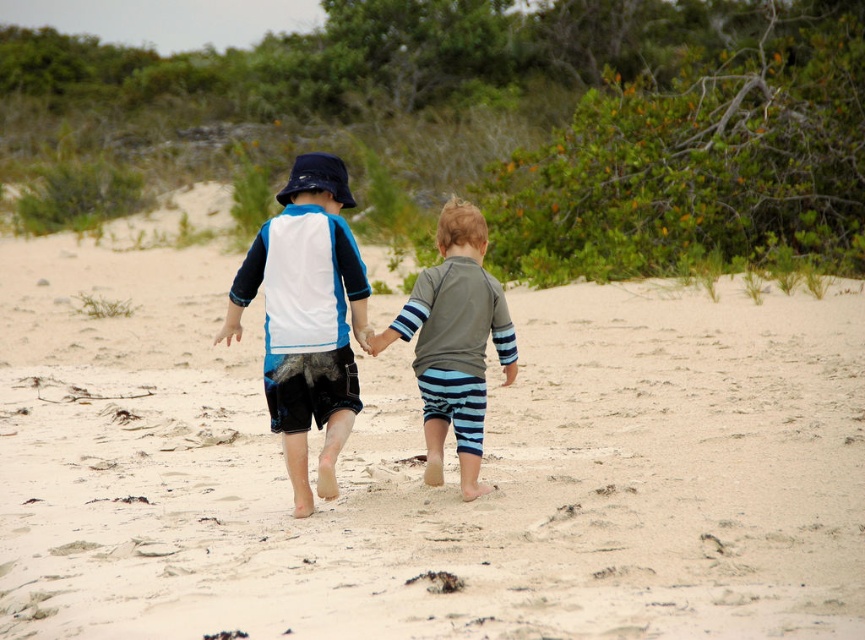
Looking at this image, between gray matte rash guard at center and blue striped shorts at center, which one appears on the left side from the viewer's perspective?

blue striped shorts at center is more to the left.

Consider the image. Can you confirm if gray matte rash guard at center is positioned to the left of blue striped shorts at center?

No, gray matte rash guard at center is not to the left of blue striped shorts at center.

Is point (468, 307) more distant than point (372, 337)?

No, (468, 307) is in front of (372, 337).

Identify the location of gray matte rash guard at center. (456, 340).

Does matte blue and white rash guard at center have a greater height compared to blue striped shorts at center?

Indeed, matte blue and white rash guard at center has a greater height compared to blue striped shorts at center.

You are a GUI agent. You are given a task and a screenshot of the screen. Output one action in this format:
    pyautogui.click(x=<x>, y=<y>)
    Task: Click on the matte blue and white rash guard at center
    
    Given the screenshot: What is the action you would take?
    pyautogui.click(x=306, y=317)

Who is more distant from viewer, (316,250) or (408,300)?

The point (408,300) is behind.

Who is higher up, matte blue and white rash guard at center or gray matte rash guard at center?

matte blue and white rash guard at center is higher up.

Is point (318, 376) positioned after point (400, 314)?

Yes, point (318, 376) is farther from viewer.

I want to click on matte blue and white rash guard at center, so click(306, 317).